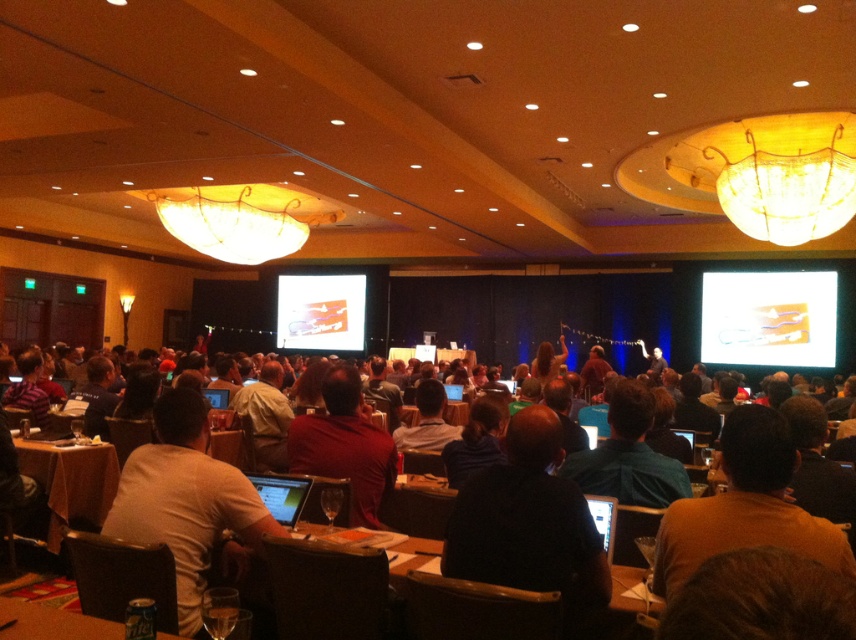
Question: Which object appears farthest from the camera in this image?

Choices:
 (A) metallic silver can at lower left
 (B) matte black laptop at center
 (C) dark brown leather jacket at center

Answer: (B)

Question: Which object is closer to the camera taking this photo?

Choices:
 (A) dark red shirt at center
 (B) matte orange projector screen at center

Answer: (A)

Question: Does white glossy laptop at center appear on the left side of matte orange projector screen at center?

Choices:
 (A) yes
 (B) no

Answer: (B)

Question: Among these points, which one is nearest to the camera?

Choices:
 (A) (724, 502)
 (B) (330, 337)
 (C) (107, 497)
 (D) (33, 611)

Answer: (A)

Question: Considering the relative positions of white matte shirt at center and wooden table at center in the image provided, where is white matte shirt at center located with respect to wooden table at center?

Choices:
 (A) below
 (B) above

Answer: (B)

Question: Considering the relative positions of matte plastic projector screen at upper right and matte gold chandelier at upper center in the image provided, where is matte plastic projector screen at upper right located with respect to matte gold chandelier at upper center?

Choices:
 (A) below
 (B) above

Answer: (A)